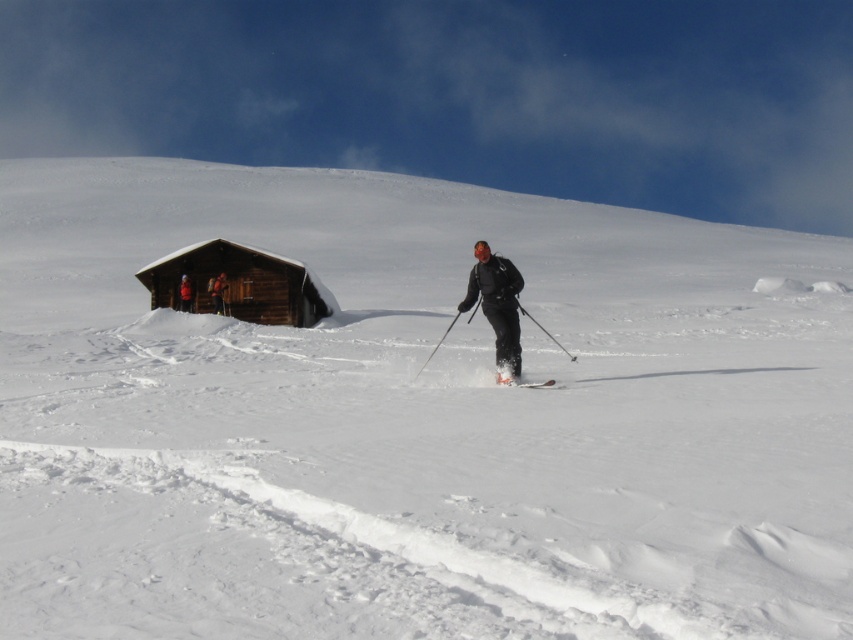
You are a photographer planning to capture a group photo of the matte black ski suit at center and the orange fabric jacket at left. Based on their positions in the scene, which person should stand closer to the camera to ensure both appear the same height in the photo?

The matte black ski suit at center is shorter than the orange fabric jacket at left, so the shorter person wearing the matte black ski suit at center should stand closer to the camera to balance their apparent heights.

You are a photographer positioned at the bottom of the slope. You want to take a photo of the brown wooden log cabin at upper left and the matte black ski suit at center. Which object will appear closer to the bottom edge of your photo?

The matte black ski suit at center is behind the brown wooden log cabin at upper left, so the cabin will block part of the ski suit in the photo. Therefore, the brown wooden log cabin at upper left will appear closer to the bottom edge of the photo than the ski suit.

You are a drone operator trying to capture a photo of the brown wooden log cabin at upper left and the matte black ski suit at center. The camera has a maximum focus range of 20 meters. Can you capture both objects in focus at the same time?

The brown wooden log cabin at upper left is 20.31 meters away from the matte black ski suit at center. Since the distance between them is slightly over 20 meters, the camera might struggle to keep both in focus simultaneously due to the limited focus range. Adjust your position or use a different lens to ensure clarity for both objects.